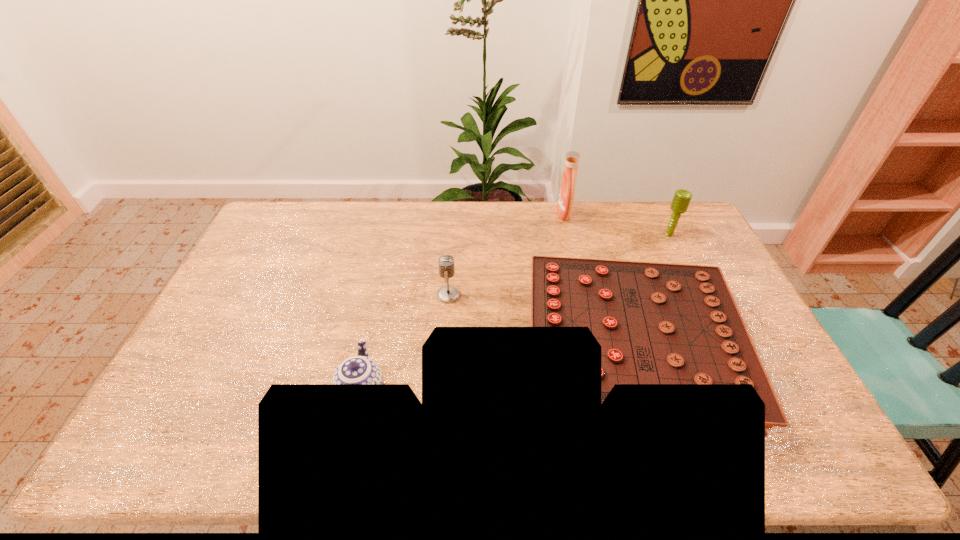
I want to click on vacant area situated 0.240m on the front-facing side of the farthest object, so click(x=495, y=214).

This screenshot has width=960, height=540. In order to click on vacant space located on the front of the fourth nearest object in this screenshot , I will do click(708, 313).

Where is `free point located 0.110m on the right of the nearer microphone`? This screenshot has height=540, width=960. free point located 0.110m on the right of the nearer microphone is located at coordinates (494, 295).

You are a GUI agent. You are given a task and a screenshot of the screen. Output one action in this format:
    pyautogui.click(x=<x>, y=<y>)
    Task: Click on the vacant space located at the spout of the leftmost object
    Image resolution: width=960 pixels, height=540 pixels.
    Given the screenshot: What is the action you would take?
    pyautogui.click(x=381, y=300)

The width and height of the screenshot is (960, 540). Find the location of `vacant area located at the spout of the leftmost object`. vacant area located at the spout of the leftmost object is located at coordinates (373, 338).

Identify the location of free space located 0.210m at the spout of the leftmost object. (381, 302).

Locate an element on the screen. The image size is (960, 540). vacant space located 0.050m on the back of the gameboard is located at coordinates pyautogui.click(x=606, y=268).

Locate an element on the screen. detergent that is positioned at the far edge is located at coordinates (567, 189).

At what (x,y) coordinates should I click in order to perform the action: click on microphone situated at the far edge. Please return your answer as a coordinate pair (x, y). This screenshot has width=960, height=540. Looking at the image, I should click on (682, 198).

I want to click on chinaware present at the near edge, so click(360, 369).